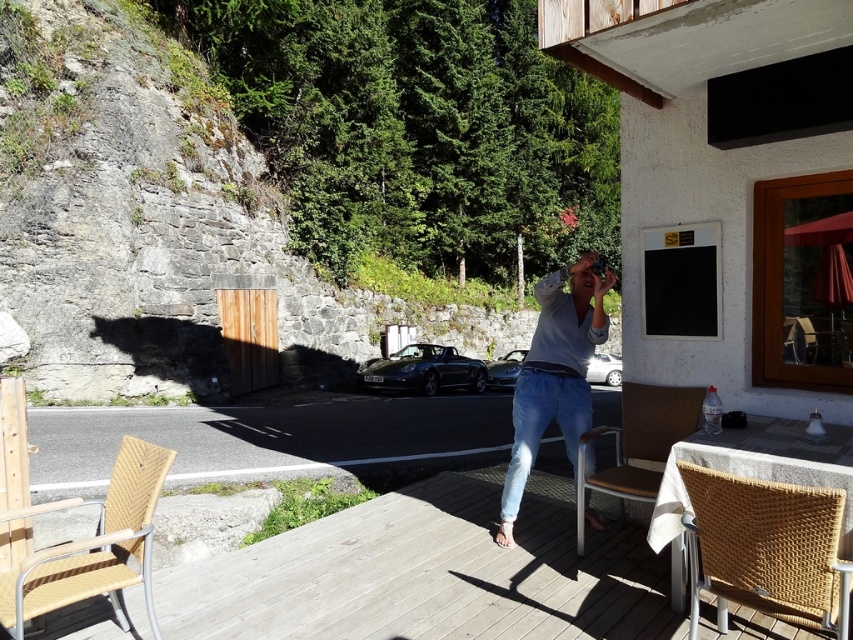
Between point (701, 588) and point (624, 516), which one is positioned behind?

Positioned behind is point (624, 516).

What do you see at coordinates (766, 548) in the screenshot? I see `woven rattan chair at lower right` at bounding box center [766, 548].

At what (x,y) coordinates should I click in order to perform the action: click on woven rattan chair at lower right. Please return your answer as a coordinate pair (x, y). Looking at the image, I should click on (766, 548).

At what (x,y) coordinates should I click in order to perform the action: click on woven rattan chair at lower right. Please return your answer as a coordinate pair (x, y). Looking at the image, I should click on (766, 548).

Does point (491, 602) lie behind point (149, 611)?

Yes, it is.

Which of these two, wooden deck at center or woven wood chair at lower left, stands taller?

Standing taller between the two is woven wood chair at lower left.

Does point (587, 550) come behind point (126, 624)?

Yes, it is behind point (126, 624).

Find the location of a particular element. This screenshot has height=640, width=853. wooden deck at center is located at coordinates (428, 573).

This screenshot has width=853, height=640. I want to click on woven wood chair at lower left, so click(93, 545).

Which of these two, woven wood chair at lower left or brown woven chair at lower right, stands taller?

brown woven chair at lower right

Who is more distant from viewer, (151, 620) or (648, 458)?

The point (648, 458) is behind.

Where is `woven wood chair at lower left`? woven wood chair at lower left is located at coordinates (93, 545).